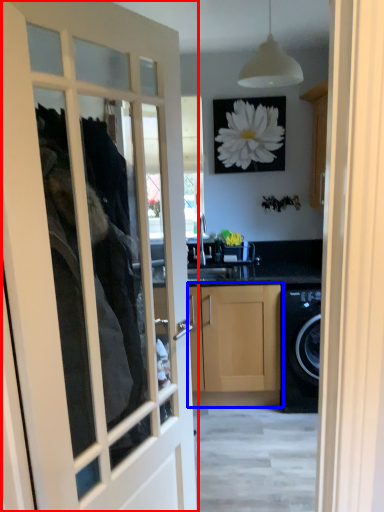
Question: Which object is closer to the camera taking this photo, door (highlighted by a red box) or cabinetry (highlighted by a blue box)?

Choices:
 (A) door
 (B) cabinetry

Answer: (A)